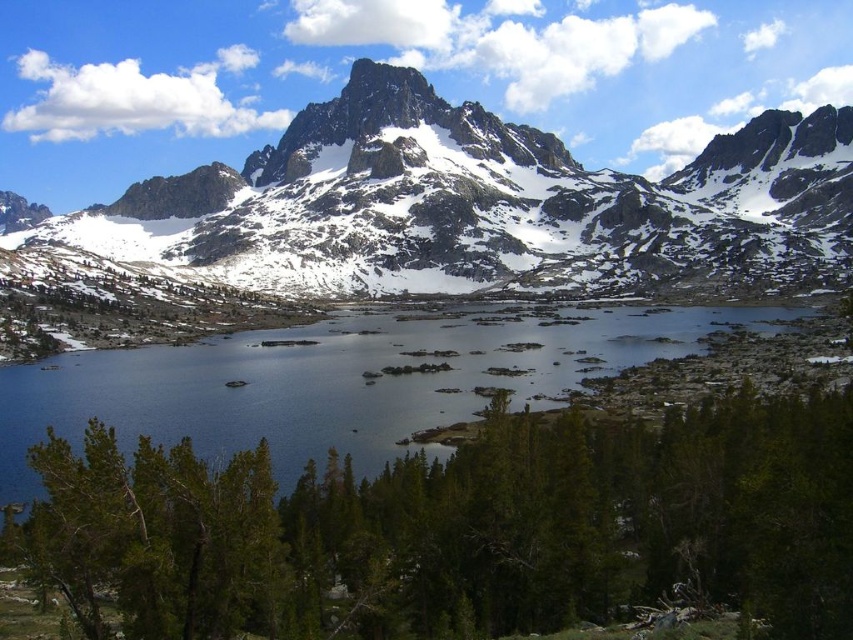
Question: Considering the relative positions of snowy granite mountain range at upper center and clear water at center in the image provided, where is snowy granite mountain range at upper center located with respect to clear water at center?

Choices:
 (A) right
 (B) left

Answer: (A)

Question: Considering the real-world distances, which object is farthest from the clear water at center?

Choices:
 (A) snowy granite mountain range at upper center
 (B) snowy granite peak at upper center

Answer: (B)

Question: Does snowy granite mountain range at upper center appear under clear water at center?

Choices:
 (A) no
 (B) yes

Answer: (A)

Question: Is snowy granite mountain range at upper center bigger than snowy granite peak at upper center?

Choices:
 (A) no
 (B) yes

Answer: (B)

Question: Which of the following is the farthest from the observer?

Choices:
 (A) snowy granite peak at upper center
 (B) snowy granite mountain range at upper center

Answer: (A)

Question: Which point is closer to the camera taking this photo?

Choices:
 (A) (122, 406)
 (B) (819, 227)

Answer: (A)